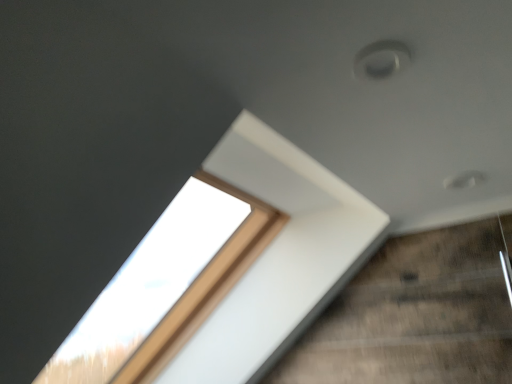
Image resolution: width=512 pixels, height=384 pixels. Identify the location of white matte ceiling hole at upper center. (381, 60).

In order to face white matte ceiling hole at upper center, should I rotate leftwards or rightwards?

It's best to rotate right around 16.647 degrees.

The image size is (512, 384). Describe the element at coordinates (381, 60) in the screenshot. I see `white matte ceiling hole at upper center` at that location.

Find the location of a particular element. This screenshot has width=512, height=384. white matte ceiling hole at upper center is located at coordinates (381, 60).